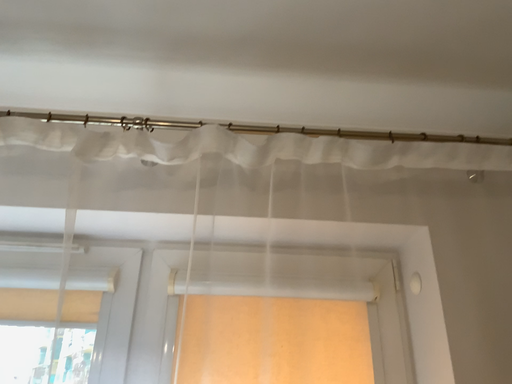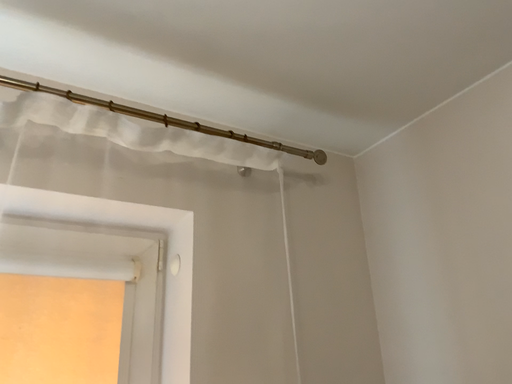
Question: How did the camera likely rotate when shooting the video?

Choices:
 (A) rotated left
 (B) rotated right

Answer: (B)